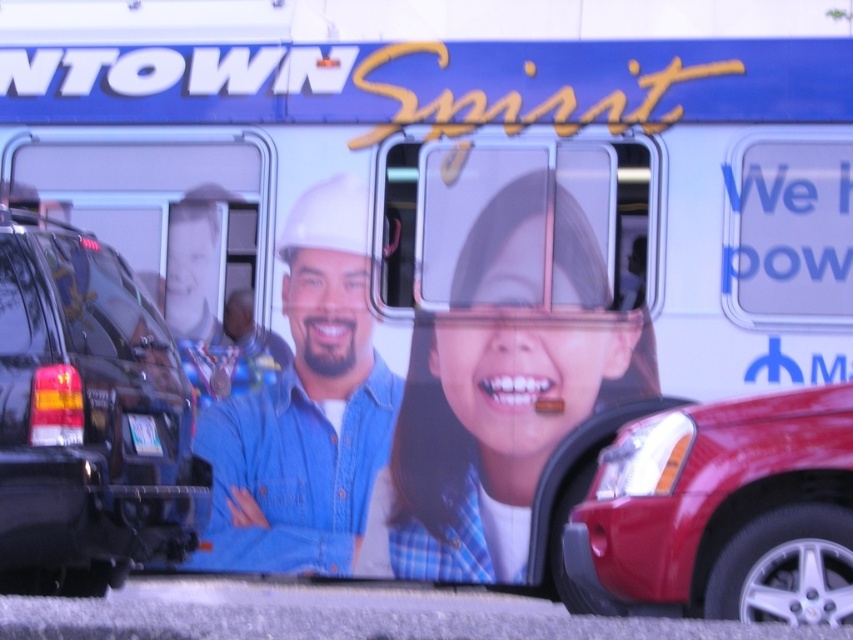
Is shiny red car at right shorter than blue denim shirt at center?

Yes.

Measure the distance between shiny red car at right and camera.

A distance of 4.98 meters exists between shiny red car at right and camera.

I want to click on shiny red car at right, so click(723, 513).

Is point (109, 472) in front of point (329, 516)?

Yes, it is in front of point (329, 516).

Does shiny black suv at left have a larger size compared to blue denim shirt at center?

Correct, shiny black suv at left is larger in size than blue denim shirt at center.

The height and width of the screenshot is (640, 853). Identify the location of shiny black suv at left. (86, 419).

The image size is (853, 640). In order to click on shiny black suv at left in this screenshot , I will do `click(86, 419)`.

Between matte blue shirt at center and shiny red car at right, which one has less height?

Standing shorter between the two is shiny red car at right.

Which is in front, point (479, 506) or point (776, 595)?

Point (776, 595) is more forward.

Which is behind, point (511, 477) or point (793, 445)?

Point (511, 477)

This screenshot has height=640, width=853. I want to click on matte blue shirt at center, so click(x=502, y=385).